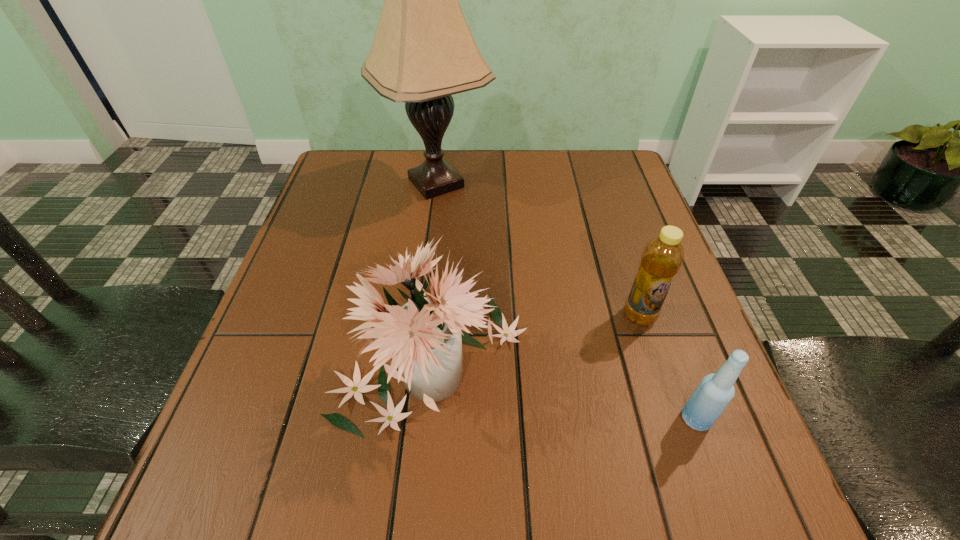
Select which object appears as the second closest to the third shortest object. Please provide its 2D coordinates. Your answer should be formatted as a tuple, i.e. [(x, y)], where the tuple contains the x and y coordinates of a point satisfying the conditions above.

[(715, 391)]

The image size is (960, 540). In order to click on object that is the closest one to the farther bottle in this screenshot , I will do `click(715, 391)`.

Where is `free space that satisfies the following two spatial constraints: 1. on the front side of the tallest object; 2. on the left side of the shortest object`? The width and height of the screenshot is (960, 540). free space that satisfies the following two spatial constraints: 1. on the front side of the tallest object; 2. on the left side of the shortest object is located at coordinates (408, 419).

This screenshot has height=540, width=960. I want to click on vacant space that satisfies the following two spatial constraints: 1. on the front side of the bouquet; 2. on the right side of the tallest object, so click(415, 360).

Find the location of a particular element. The width and height of the screenshot is (960, 540). free space that satisfies the following two spatial constraints: 1. on the front side of the farthest object; 2. on the right side of the third shortest object is located at coordinates (415, 360).